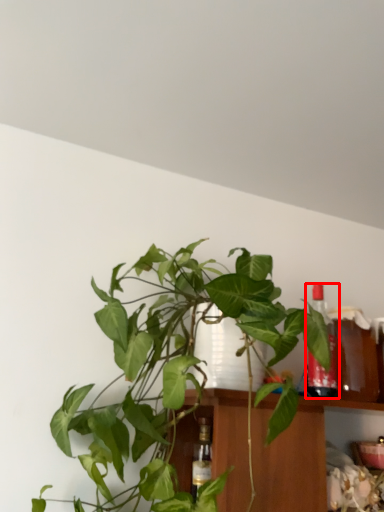
Question: From the image's perspective, where is bottle (annotated by the red box) located relative to houseplant?

Choices:
 (A) above
 (B) below

Answer: (B)